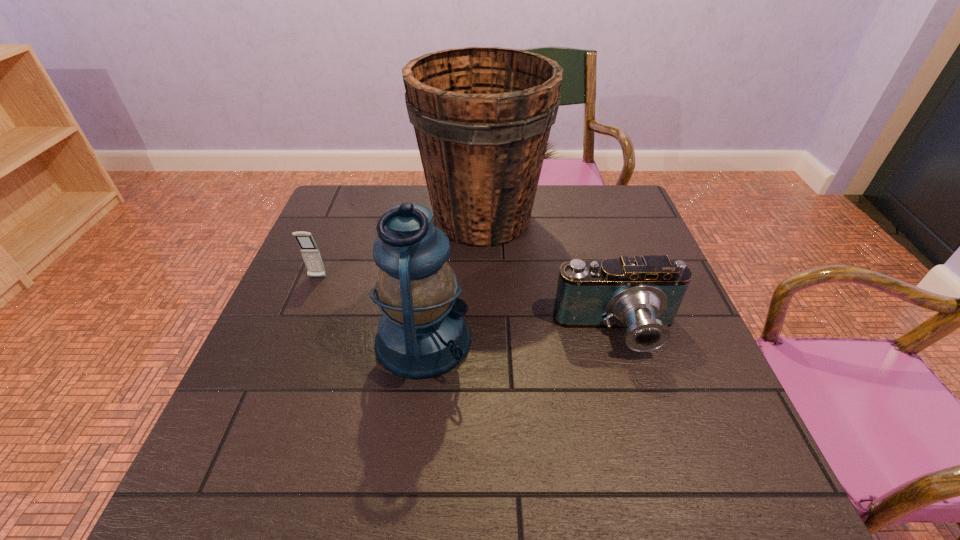
Identify the location of object that is positioned at the far edge. (482, 116).

Find the location of a particular element. The width and height of the screenshot is (960, 540). object present at the left edge is located at coordinates (310, 252).

The height and width of the screenshot is (540, 960). I want to click on object that is at the right edge, so click(643, 294).

Where is `free space at the near edge of the desktop`? This screenshot has height=540, width=960. free space at the near edge of the desktop is located at coordinates (491, 466).

In the image, there is a desktop. Find the location of `free space at the left edge`. free space at the left edge is located at coordinates click(x=240, y=400).

Find the location of `vacant space at the right edge`. vacant space at the right edge is located at coordinates (612, 244).

This screenshot has width=960, height=540. What are the coordinates of `blank space at the far left corner of the desktop` in the screenshot? It's located at (337, 199).

Locate an element on the screen. The height and width of the screenshot is (540, 960). blank area at the near right corner is located at coordinates (732, 466).

Identify the location of vacant space that's between the camcorder and the lantern. The image size is (960, 540). (520, 336).

What are the coordinates of `vacant area that lies between the leftmost object and the camcorder` in the screenshot? It's located at point(468,305).